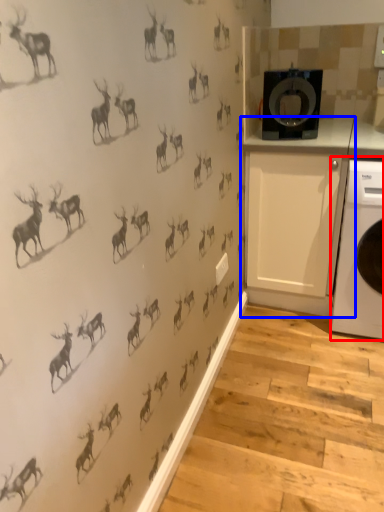
Question: Which object appears farthest to the camera in this image, home appliance (highlighted by a red box) or cabinetry (highlighted by a blue box)?

Choices:
 (A) home appliance
 (B) cabinetry

Answer: (B)